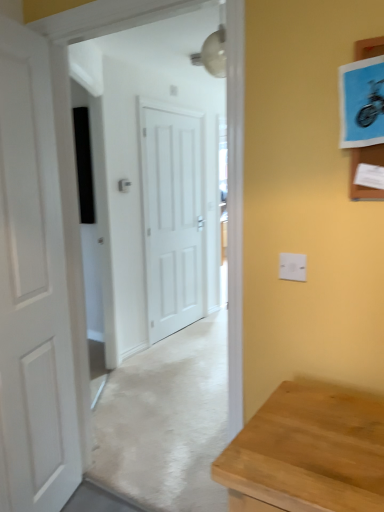
Question: Is white matte door at center, which is the 1th door in right-to-left order, shorter than white plastic electric outlet at upper right?

Choices:
 (A) no
 (B) yes

Answer: (A)

Question: Does white matte door at center, which is the second door in front-to-back order, have a greater width compared to white plastic electric outlet at upper right?

Choices:
 (A) no
 (B) yes

Answer: (B)

Question: Can you confirm if white matte door at center, which appears as the second door when viewed from the left, is thinner than white plastic electric outlet at upper right?

Choices:
 (A) no
 (B) yes

Answer: (A)

Question: Can you confirm if white matte door at center, which is the 1th door in right-to-left order, is smaller than white plastic electric outlet at upper right?

Choices:
 (A) yes
 (B) no

Answer: (B)

Question: Is white matte door at center, which is the second door in front-to-back order, at the right side of white plastic electric outlet at upper right?

Choices:
 (A) no
 (B) yes

Answer: (A)

Question: Considering the positions of point (281, 259) and point (34, 475), is point (281, 259) closer or farther from the camera than point (34, 475)?

Choices:
 (A) farther
 (B) closer

Answer: (B)

Question: Considering the relative positions of white plastic electric outlet at upper right and white matte door at left, the first door positioned from the left, in the image provided, is white plastic electric outlet at upper right to the left or to the right of white matte door at left, the first door positioned from the left,?

Choices:
 (A) left
 (B) right

Answer: (B)

Question: Is white plastic electric outlet at upper right spatially inside white matte door at left, the 1th door from the front, or outside of it?

Choices:
 (A) inside
 (B) outside

Answer: (B)

Question: From a real-world perspective, is white plastic electric outlet at upper right physically located above or below white matte door at left, the second door positioned from the back?

Choices:
 (A) below
 (B) above

Answer: (B)

Question: In terms of width, does white plastic electric outlet at upper right look wider or thinner when compared to white matte door at center, which is the 1th door in right-to-left order?

Choices:
 (A) wide
 (B) thin

Answer: (B)

Question: In terms of height, does white plastic electric outlet at upper right look taller or shorter compared to white matte door at center, which is the 1th door in right-to-left order?

Choices:
 (A) tall
 (B) short

Answer: (B)

Question: Considering the positions of white plastic electric outlet at upper right and white matte door at center, which ranks as the first door in back-to-front order, in the image, is white plastic electric outlet at upper right bigger or smaller than white matte door at center, which ranks as the first door in back-to-front order,?

Choices:
 (A) small
 (B) big

Answer: (A)

Question: From the image's perspective, is white plastic electric outlet at upper right positioned above or below white matte door at center, which is the second door in front-to-back order?

Choices:
 (A) above
 (B) below

Answer: (B)

Question: Do you think white matte door at center, which appears as the second door when viewed from the left, is within white plastic electric outlet at upper right, or outside of it?

Choices:
 (A) outside
 (B) inside

Answer: (A)

Question: From the image's perspective, relative to white plastic electric outlet at upper right, is white matte door at center, which appears as the second door when viewed from the left, above or below?

Choices:
 (A) below
 (B) above

Answer: (B)